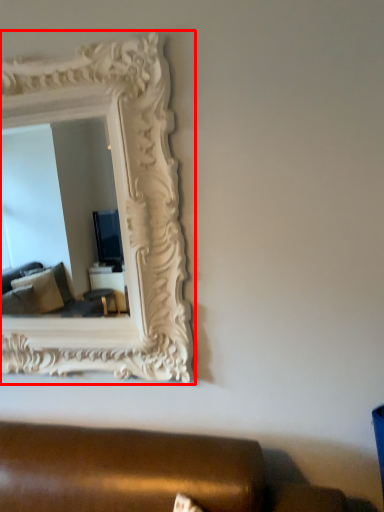
Question: Where is picture frame (annotated by the red box) located in relation to studio couch in the image?

Choices:
 (A) left
 (B) right

Answer: (A)